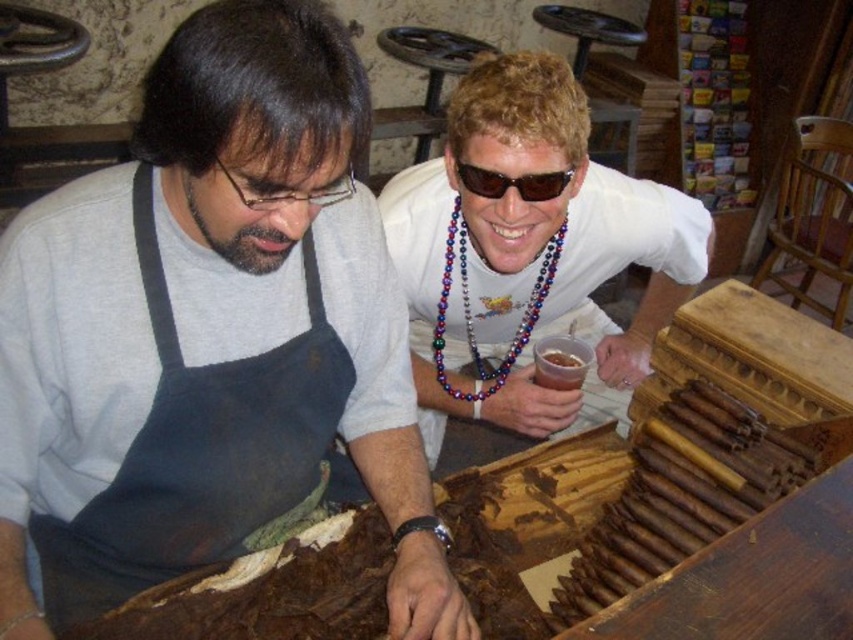
Question: Considering the real-world distances, which object is farthest from the multicolored beaded necklace at upper center?

Choices:
 (A) matte gray apron at center
 (B) sunglasses at upper center
 (C) white matte shirt at upper center

Answer: (A)

Question: Among these objects, which one is farthest from the camera?

Choices:
 (A) matte gray apron at center
 (B) white matte shirt at upper center
 (C) sunglasses at upper center

Answer: (C)

Question: From the image, what is the correct spatial relationship of white matte shirt at upper center in relation to sunglasses at upper center?

Choices:
 (A) left
 (B) right

Answer: (B)

Question: Can you confirm if matte gray apron at center is bigger than white matte shirt at upper center?

Choices:
 (A) no
 (B) yes

Answer: (A)

Question: Is white matte shirt at upper center to the right of matte black glasses at upper left from the viewer's perspective?

Choices:
 (A) no
 (B) yes

Answer: (B)

Question: Based on their relative distances, which object is nearer to the sunglasses at upper center?

Choices:
 (A) matte black glasses at upper left
 (B) multicolored beaded necklace at upper center
 (C) matte gray apron at center

Answer: (A)